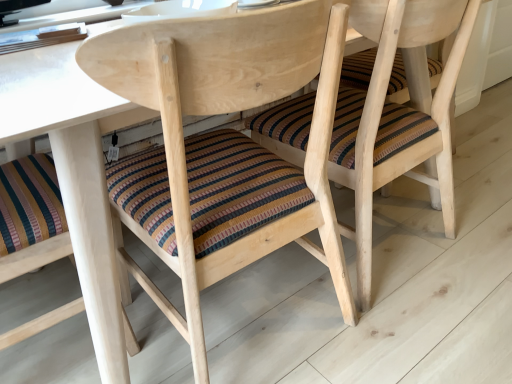
Where is `vacant space to the right of striped fabric cushion at center, placed as the 1th chair when sorted from right to left`? The width and height of the screenshot is (512, 384). vacant space to the right of striped fabric cushion at center, placed as the 1th chair when sorted from right to left is located at coordinates (460, 226).